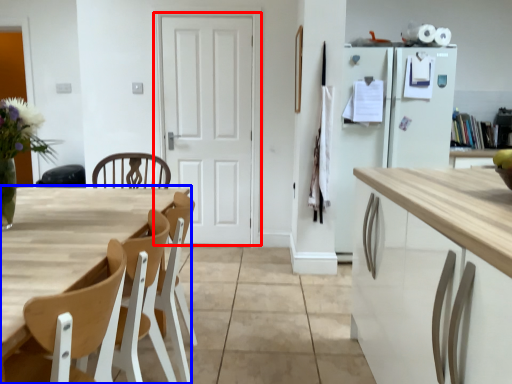
Question: Among these objects, which one is farthest to the camera, door (highlighted by a red box) or table (highlighted by a blue box)?

Choices:
 (A) door
 (B) table

Answer: (A)